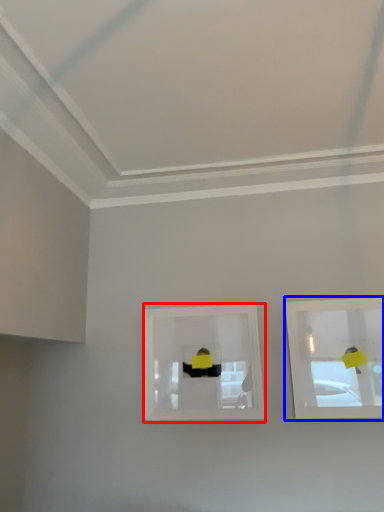
Question: Among these objects, which one is farthest to the camera, picture frame (highlighted by a red box) or picture frame (highlighted by a blue box)?

Choices:
 (A) picture frame
 (B) picture frame

Answer: (A)